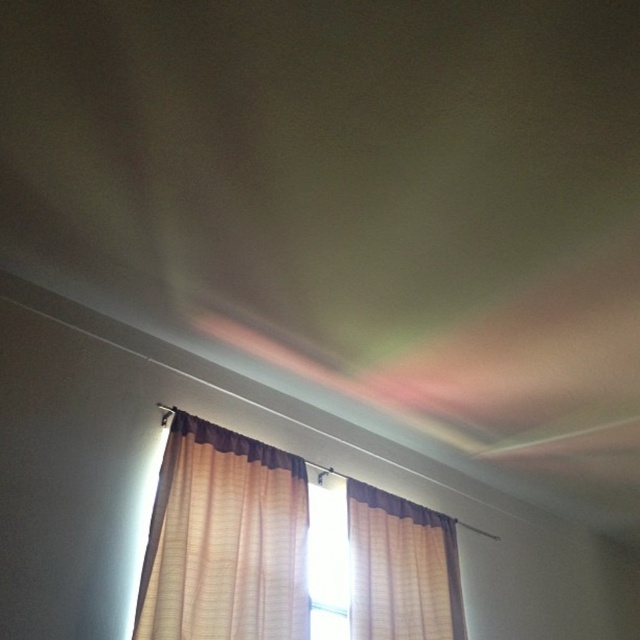
You are standing in the room and want to see outside through the transparent glass window at center. However, the beige fabric curtain at lower left is blocking your view. Can you move the curtain to the side to get a clear view?

The beige fabric curtain at lower left is in front of the transparent glass window at center, so moving it aside would allow you to see through the window clearly.

You are an interior designer assessing the room layout. You notice the beige fabric curtain at lower left and the beige textured curtain at upper right. Which curtain is taller?

The beige fabric curtain at lower left is taller than the beige textured curtain at upper right.

You are an interior designer assessing the room. You notice the beige fabric curtain at lower left and the beige textured curtain at upper right. Which curtain would you recommend for a client who wants to block more light?

The beige fabric curtain at lower left has a larger size compared to the beige textured curtain at upper right, so it would block more light due to its greater size.